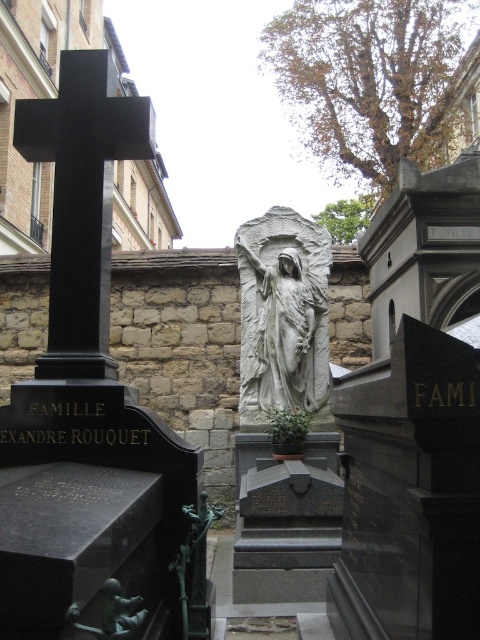
You are a tour guide explaining the cemetery layout to visitors. Pointing to the white stone statue at center and the green patina statue at lower center, you want to describe their spatial relationship. Which statue is located higher up in the image?

The white stone statue at center is positioned over the green patina statue at lower center, meaning it is higher up in the image.

You are a tour guide leading a group through the cemetery. You want to point out both the black polished stone cross at upper left and the white stone statue at center to your group. If your group is standing 10 meters away from the cross, how far apart will the two monuments appear to them?

The black polished stone cross at upper left and white stone statue at center are 4.65 meters apart from each other. Since the group is 10 meters away from the cross, the distance between the two monuments will still be 4.65 meters as perceived from that distance.

You are a photographer planning to take a wide shot of the cemetery scene. You need to ensure both the black polished stone cross at upper left and the white stone statue at center are fully visible in the frame. Considering their sizes, which object might require you to adjust your camera angle to avoid cropping?

The white stone statue at center has a greater width than the black polished stone cross at upper left, so it might require adjusting the camera angle to ensure it fits entirely within the frame without cropping.